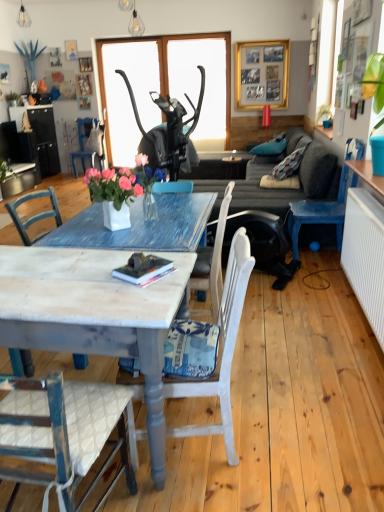
Question: From a real-world perspective, is metallic pendant light at upper center, which ranks as the 2th lamp in back-to-front order, over blue painted wood chair at left, which appears as the 3th chair when ordered from the bottom?

Choices:
 (A) yes
 (B) no

Answer: (A)

Question: Is metallic pendant light at upper center, the 2th lamp when ordered from left to right, facing away from blue painted wood chair at left, which appears as the third chair when viewed from the right?

Choices:
 (A) yes
 (B) no

Answer: (B)

Question: Considering the relative sizes of metallic pendant light at upper center, which ranks as the 2th lamp in back-to-front order, and blue painted wood chair at left, which appears as the 3th chair when ordered from the bottom, in the image provided, is metallic pendant light at upper center, which ranks as the 2th lamp in back-to-front order, taller than blue painted wood chair at left, which appears as the 3th chair when ordered from the bottom,?

Choices:
 (A) no
 (B) yes

Answer: (A)

Question: Is the depth of metallic pendant light at upper center, positioned as the 2th lamp in top-to-bottom order, greater than that of blue painted wood chair at left, arranged as the third chair when viewed from the front?

Choices:
 (A) no
 (B) yes

Answer: (A)

Question: Considering the relative sizes of metallic pendant light at upper center, the 1th lamp in the front-to-back sequence, and blue painted wood chair at left, the first chair when ordered from back to front, in the image provided, is metallic pendant light at upper center, the 1th lamp in the front-to-back sequence, smaller than blue painted wood chair at left, the first chair when ordered from back to front,?

Choices:
 (A) no
 (B) yes

Answer: (B)

Question: Looking at their shapes, would you say white painted wood chair at lower center, which is the 1th chair from front to back, is wider or thinner than metallic pendant light at upper center, marked as the first lamp in a right-to-left arrangement?

Choices:
 (A) wide
 (B) thin

Answer: (A)

Question: From a real-world perspective, is white painted wood chair at lower center, which ranks as the 3th chair in top-to-bottom order, positioned above or below metallic pendant light at upper center, the 2th lamp when ordered from left to right?

Choices:
 (A) above
 (B) below

Answer: (B)

Question: Does point (228, 287) appear closer or farther from the camera than point (137, 31)?

Choices:
 (A) closer
 (B) farther

Answer: (A)

Question: From the image's perspective, relative to metallic pendant light at upper center, marked as the first lamp in a right-to-left arrangement, is white painted wood chair at lower center, which is the third chair in back-to-front order, above or below?

Choices:
 (A) above
 (B) below

Answer: (B)

Question: From a real-world perspective, is black matte mask at center, placed as the 1th window screen when sorted from right to left, positioned above or below white painted wood chair at lower center, which ranks as the 3th chair in top-to-bottom order?

Choices:
 (A) below
 (B) above

Answer: (B)

Question: Is black matte mask at center, which appears as the 2th window screen when viewed from the left, taller or shorter than white painted wood chair at lower center, the 2th chair from the left?

Choices:
 (A) tall
 (B) short

Answer: (A)

Question: Is black matte mask at center, which appears as the 2th window screen when viewed from the left, spatially inside white painted wood chair at lower center, which ranks as the 3th chair in top-to-bottom order, or outside of it?

Choices:
 (A) outside
 (B) inside

Answer: (A)

Question: From the image's perspective, is black matte mask at center, which appears as the 2th window screen when viewed from the left, located above or below white painted wood chair at lower center, the second chair in the right-to-left sequence?

Choices:
 (A) below
 (B) above

Answer: (B)

Question: Based on their positions, is black matte mask at center, placed as the 1th window screen when sorted from right to left, located to the left or right of metallic wire bulb at upper center, which is the first lamp from top to bottom?

Choices:
 (A) right
 (B) left

Answer: (A)

Question: From a real-world perspective, is black matte mask at center, placed as the 1th window screen when sorted from right to left, positioned above or below metallic wire bulb at upper center, which is counted as the 2th lamp, starting from the bottom?

Choices:
 (A) above
 (B) below

Answer: (B)